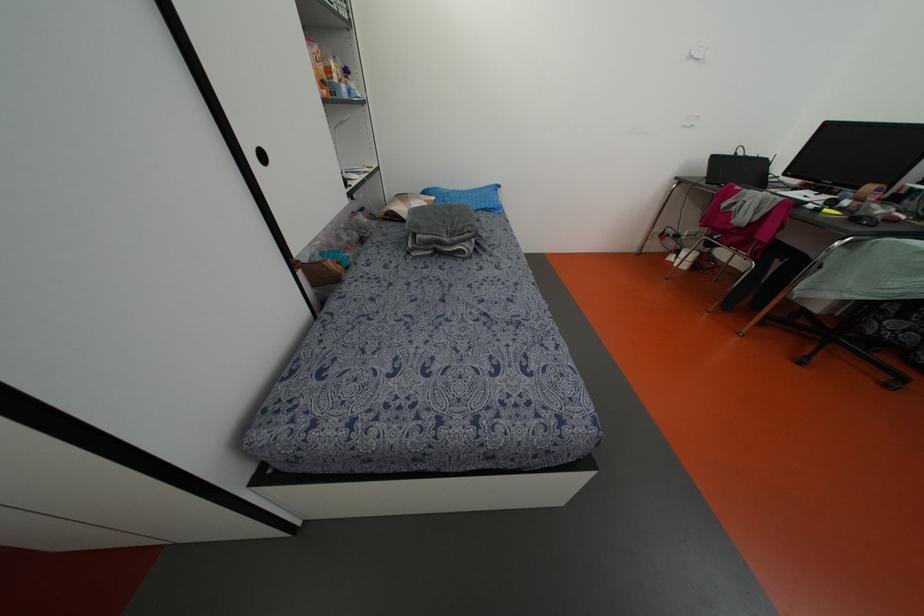
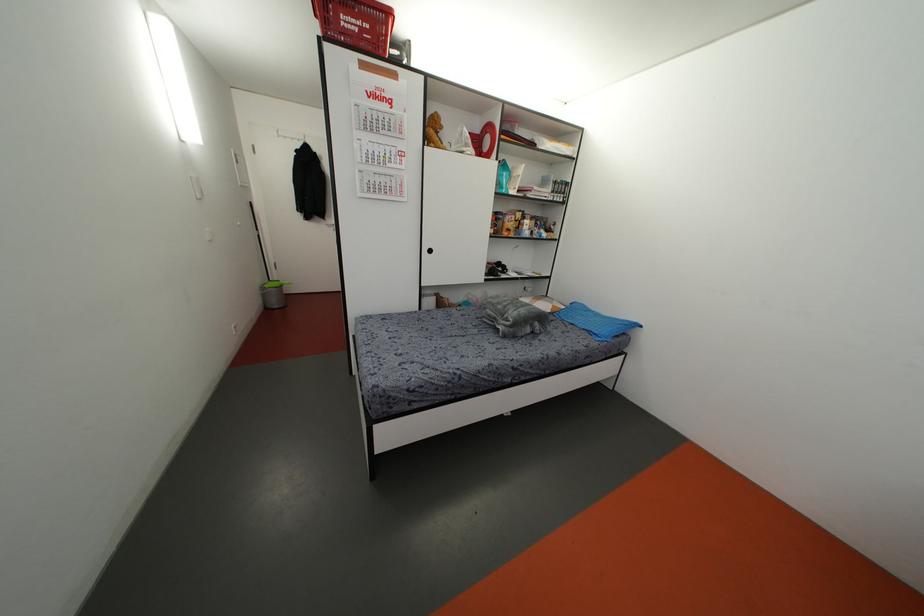
Locate, in the second image, the point that corresponds to point (492, 206) in the first image.

(596, 331)